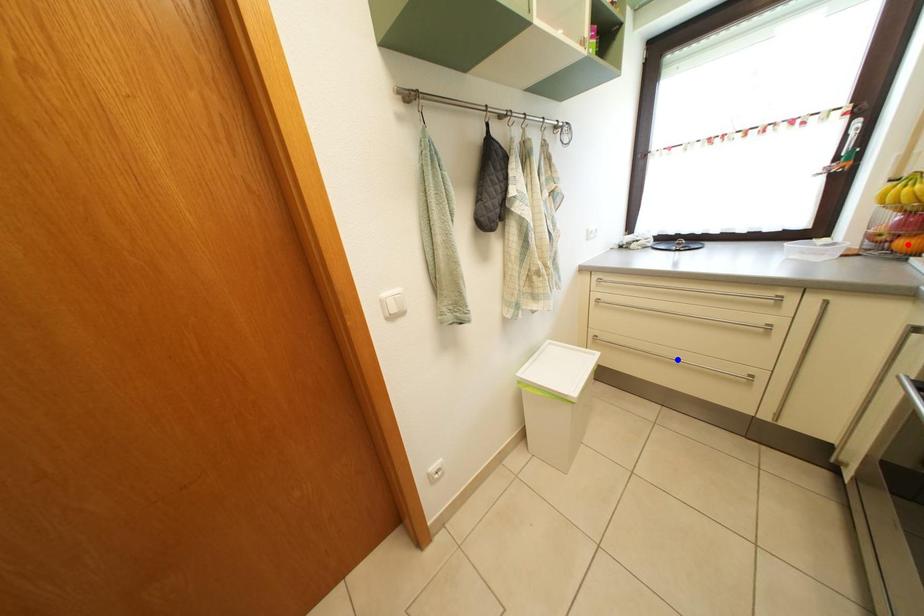
Question: Two points are marked on the image. Which point is closer to the camera?

Choices:
 (A) Blue point is closer.
 (B) Red point is closer.

Answer: (B)